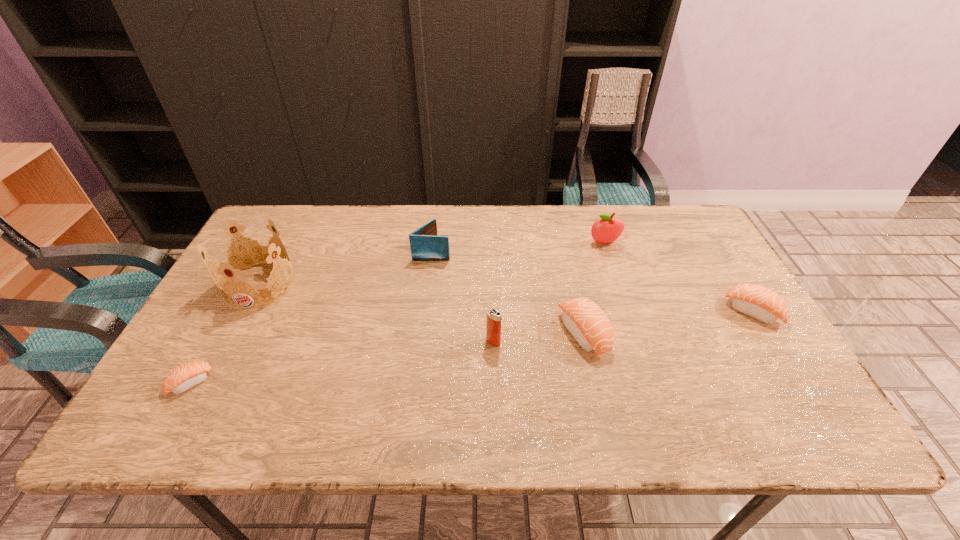
In the image, there is a desktop. Where is `free space at the near right corner`? free space at the near right corner is located at coordinates (774, 386).

In order to click on free space between the rightmost object and the sixth object from left to right in this screenshot , I will do `click(679, 278)`.

Identify the location of free space between the nearest sushi and the igniter. This screenshot has width=960, height=540. (342, 362).

Identify the location of free space that is in between the fifth object from right to left and the fifth object from left to right. This screenshot has width=960, height=540. (508, 292).

Where is `vacant space that is in between the apple and the tallest object`? vacant space that is in between the apple and the tallest object is located at coordinates (432, 264).

In order to click on empty space that is in between the rightmost sushi and the igniter in this screenshot , I will do `click(623, 327)`.

Where is `free point between the second tallest sushi and the sixth object from left to right`? Image resolution: width=960 pixels, height=540 pixels. free point between the second tallest sushi and the sixth object from left to right is located at coordinates (679, 278).

The height and width of the screenshot is (540, 960). Find the location of `vacant area that lies between the third object from right to left and the shortest object`. vacant area that lies between the third object from right to left and the shortest object is located at coordinates (387, 358).

This screenshot has height=540, width=960. In order to click on free space between the igniter and the sixth tallest object in this screenshot , I will do `click(623, 327)`.

Find the location of a particular element. The image size is (960, 540). free space between the leftmost sushi and the crown is located at coordinates (226, 334).